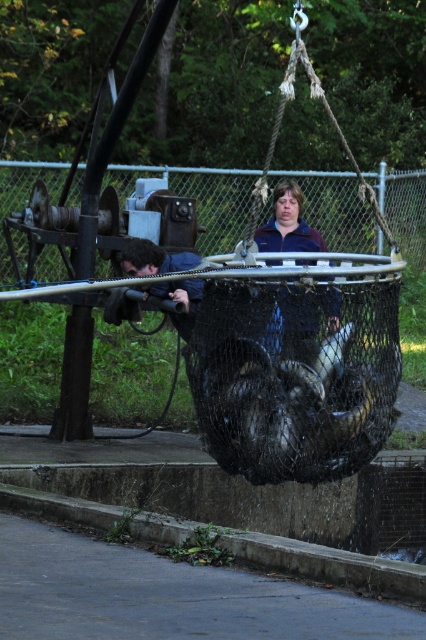
Does purple fleece jacket at center appear on the right side of blue fabric jacket at center?

Yes, purple fleece jacket at center is to the right of blue fabric jacket at center.

Between purple fleece jacket at center and blue fabric jacket at center, which one has less height?

purple fleece jacket at center is shorter.

Find the location of a particular element. The width and height of the screenshot is (426, 640). purple fleece jacket at center is located at coordinates (287, 224).

The image size is (426, 640). Find the location of `purple fleece jacket at center`. purple fleece jacket at center is located at coordinates point(287,224).

Can you confirm if concrete at lower left is shorter than purple fleece jacket at center?

Indeed, concrete at lower left has a lesser height compared to purple fleece jacket at center.

Which is in front, point (371, 556) or point (262, 234)?

Point (371, 556) is more forward.

The width and height of the screenshot is (426, 640). In order to click on concrete at lower left in this screenshot , I will do `click(327, 564)`.

At what (x,y) coordinates should I click in order to perform the action: click on concrete at lower left. Please return your answer as a coordinate pair (x, y). The image size is (426, 640). Looking at the image, I should click on (327, 564).

Does concrete at lower left appear on the left side of blue fabric jacket at center?

Incorrect, concrete at lower left is not on the left side of blue fabric jacket at center.

Can you confirm if concrete at lower left is wider than blue fabric jacket at center?

Indeed, concrete at lower left has a greater width compared to blue fabric jacket at center.

The width and height of the screenshot is (426, 640). I want to click on concrete at lower left, so click(x=327, y=564).